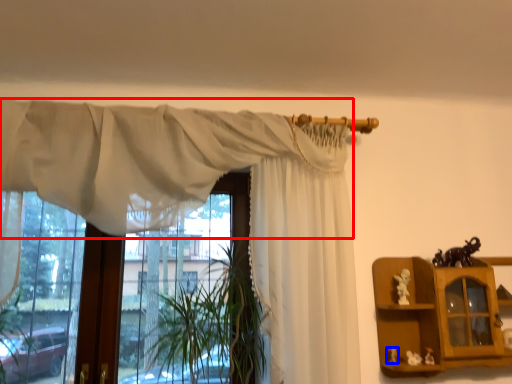
Question: Which object is closer to the camera taking this photo, curtain (highlighted by a red box) or toy (highlighted by a blue box)?

Choices:
 (A) curtain
 (B) toy

Answer: (A)